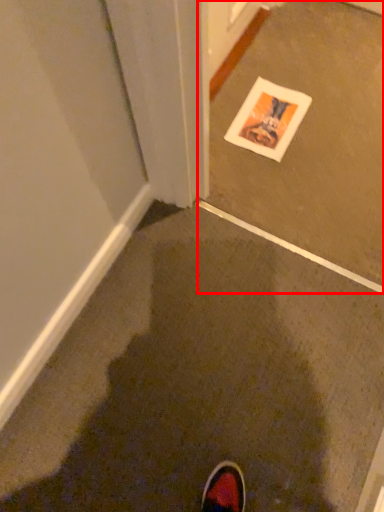
Question: In this image, where is concrete (annotated by the red box) located relative to mud?

Choices:
 (A) right
 (B) left

Answer: (A)